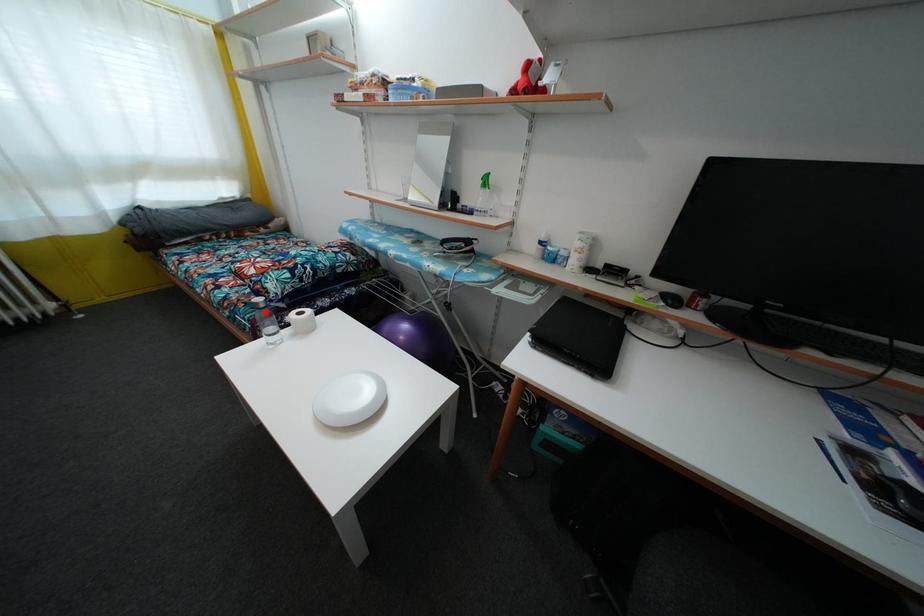
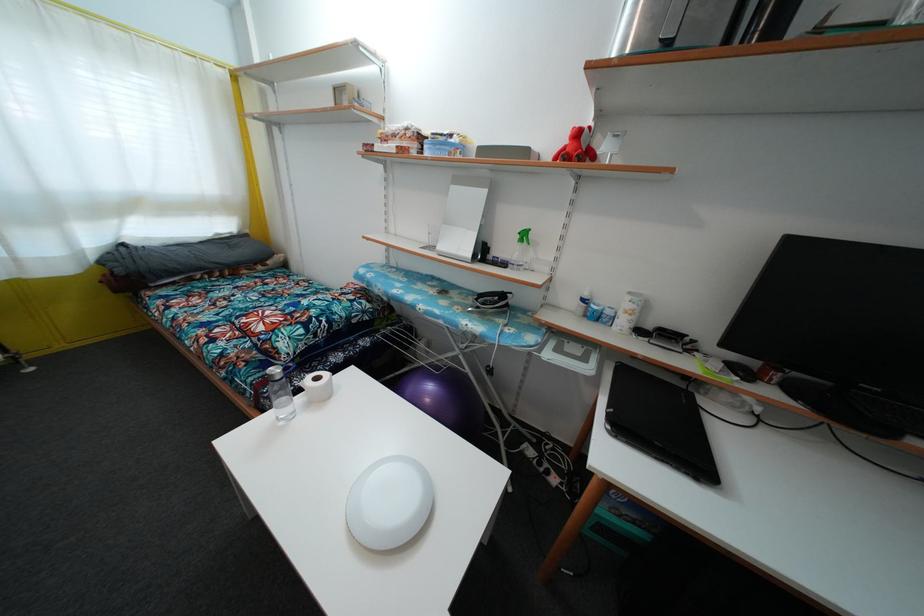
Question: I am providing you with two images of the same scene from different viewpoints. A red point is marked on the first image. Is the red point's position out of view in image 2?

Choices:
 (A) Yes
 (B) No

Answer: (B)